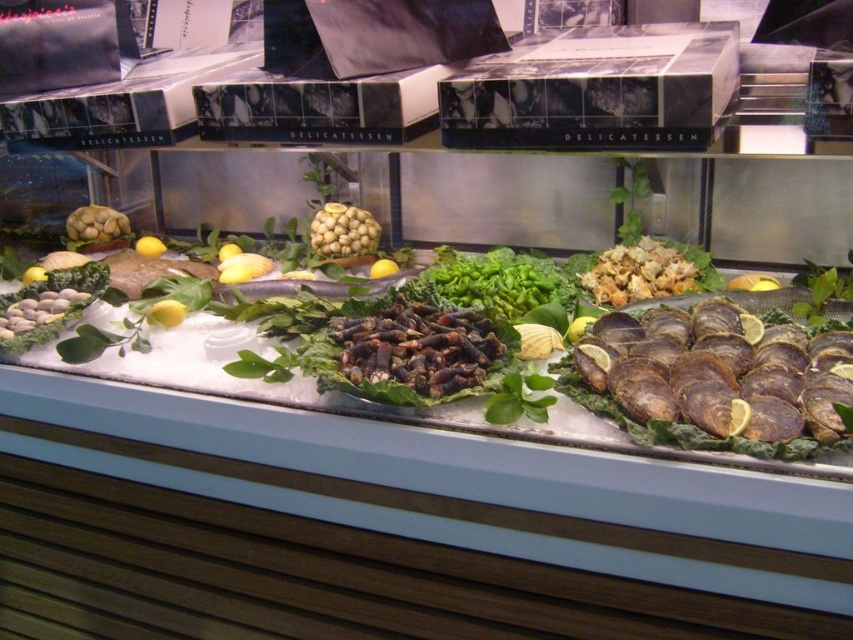
Question: Which object is positioned farthest from the brown textured oysters at center?

Choices:
 (A) green leafy vegetable at center
 (B) smooth beige nuts at center
 (C) green matte artichoke at left

Answer: (C)

Question: Can you confirm if green leafy vegetable at center is wider than green matte artichoke at left?

Choices:
 (A) no
 (B) yes

Answer: (B)

Question: Considering the real-world distances, which object is closest to the brown textured oysters at center?

Choices:
 (A) green matte artichoke at left
 (B) smooth beige nuts at center

Answer: (B)

Question: Considering the real-world distances, which object is farthest from the green leafy vegetable at center?

Choices:
 (A) green matte artichoke at left
 (B) smooth beige nuts at center

Answer: (A)

Question: Does brown textured oysters at center have a smaller size compared to green matte artichoke at left?

Choices:
 (A) yes
 (B) no

Answer: (B)

Question: Is green leafy vegetable at center to the right of smooth beige nuts at center from the viewer's perspective?

Choices:
 (A) yes
 (B) no

Answer: (A)